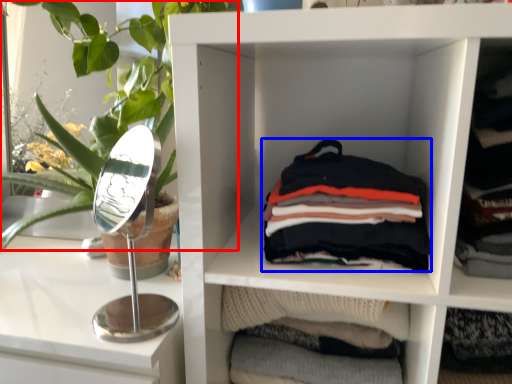
Question: Which of the following is the farthest to the observer, plant (highlighted by a red box) or material (highlighted by a blue box)?

Choices:
 (A) plant
 (B) material

Answer: (B)